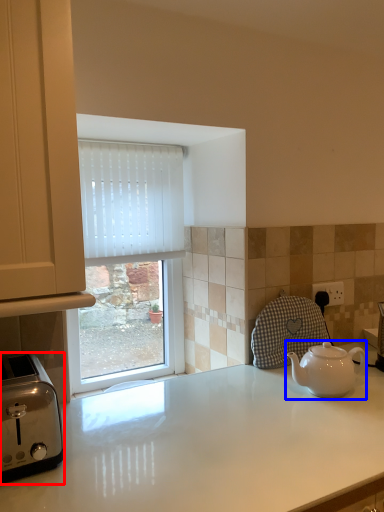
Question: Which of the following is the farthest to the observer, toaster (highlighted by a red box) or kettle (highlighted by a blue box)?

Choices:
 (A) toaster
 (B) kettle

Answer: (B)